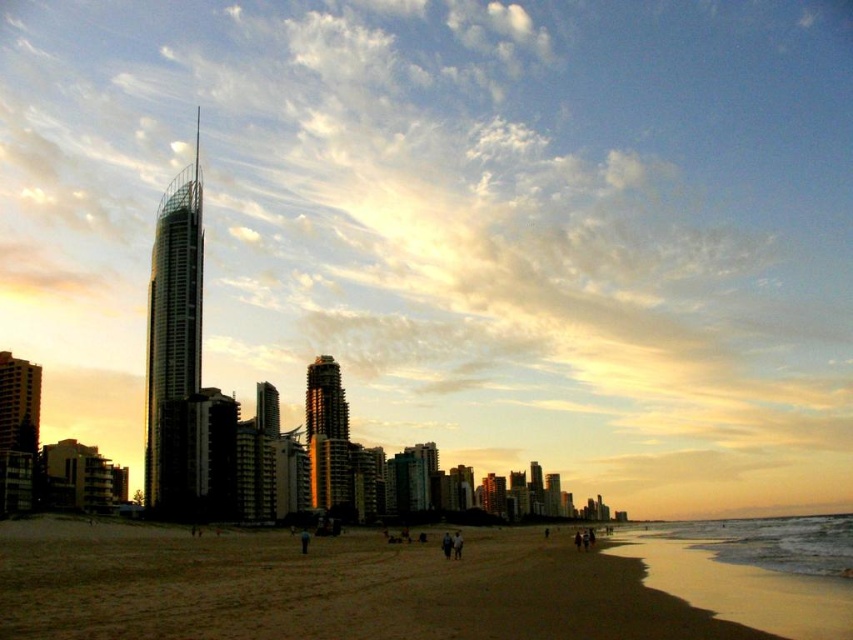
Can you confirm if brown sand at lower left is shorter than gold reflective glass tower at center?

In fact, brown sand at lower left may be taller than gold reflective glass tower at center.

Who is more forward, (440,620) or (345,432)?

Point (440,620) is more forward.

Which is behind, point (503, 634) or point (341, 470)?

The point (341, 470) is behind.

Locate an element on the screen. Image resolution: width=853 pixels, height=640 pixels. brown sand at lower left is located at coordinates (422, 582).

Based on the photo, is brown sand at lower left shorter than shiny glass skyscraper at center?

Correct, brown sand at lower left is not as tall as shiny glass skyscraper at center.

Between point (735, 577) and point (148, 336), which one is positioned in front?

Point (735, 577)

Which is in front, point (703, 616) or point (149, 362)?

Positioned in front is point (703, 616).

Locate an element on the screen. The image size is (853, 640). brown sand at lower left is located at coordinates (422, 582).

Which is above, shiny glass skyscraper at center or gold reflective glass tower at center?

shiny glass skyscraper at center

Between shiny glass skyscraper at center and gold reflective glass tower at center, which one is positioned lower?

gold reflective glass tower at center

Where is `shiny glass skyscraper at center`? The height and width of the screenshot is (640, 853). shiny glass skyscraper at center is located at coordinates (173, 305).